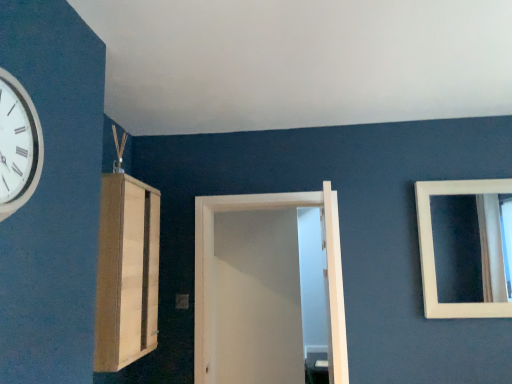
At what (x,y) coordinates should I click in order to perform the action: click on vacant area on top of white matte mirror at upper right (from a real-world perspective). Please return your answer as a coordinate pair (x, y). The image size is (512, 384). Looking at the image, I should click on (459, 183).